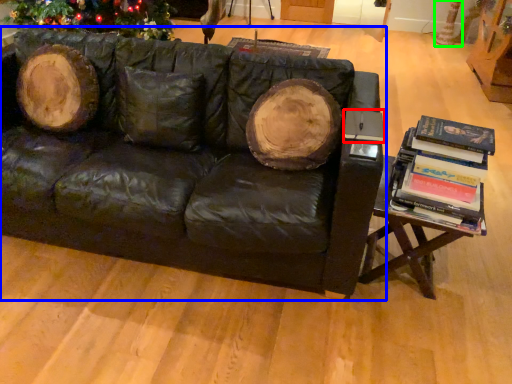
Question: Based on their relative distances, which object is farther from paperback book (highlighted by a red box)? Choose from studio couch (highlighted by a blue box) and tree trunk (highlighted by a green box).

Choices:
 (A) studio couch
 (B) tree trunk

Answer: (B)